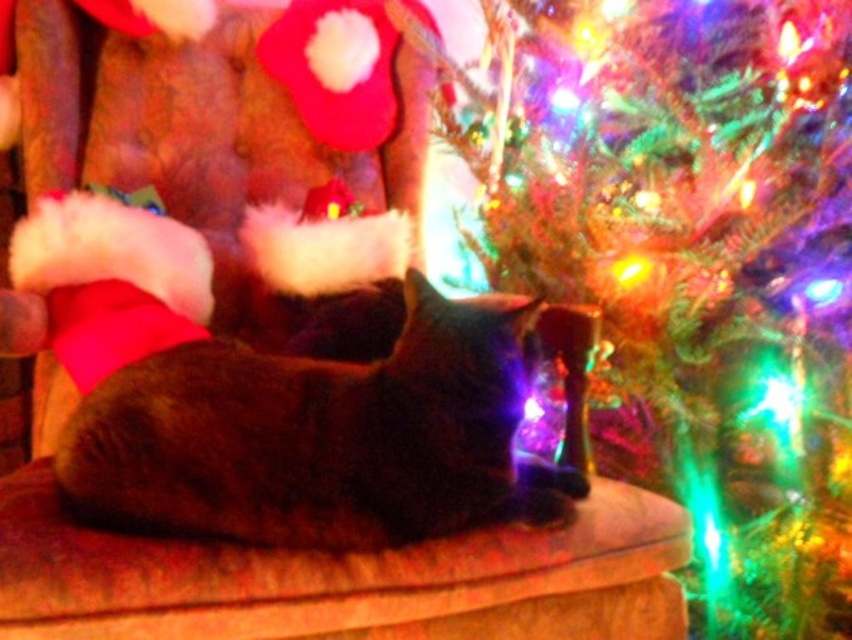
Question: Which point is farther to the camera?

Choices:
 (A) tap(442, 397)
 (B) tap(684, 284)

Answer: (B)

Question: In this image, where is shiny green needles at upper right located relative to dark brown fur cat at center?

Choices:
 (A) left
 (B) right

Answer: (B)

Question: Which point appears farthest from the camera in this image?

Choices:
 (A) (496, 484)
 (B) (717, 144)

Answer: (B)

Question: Where is shiny green needles at upper right located in relation to dark brown fur cat at center in the image?

Choices:
 (A) below
 (B) above

Answer: (B)

Question: Can you confirm if shiny green needles at upper right is positioned to the right of dark brown fur cat at center?

Choices:
 (A) yes
 (B) no

Answer: (A)